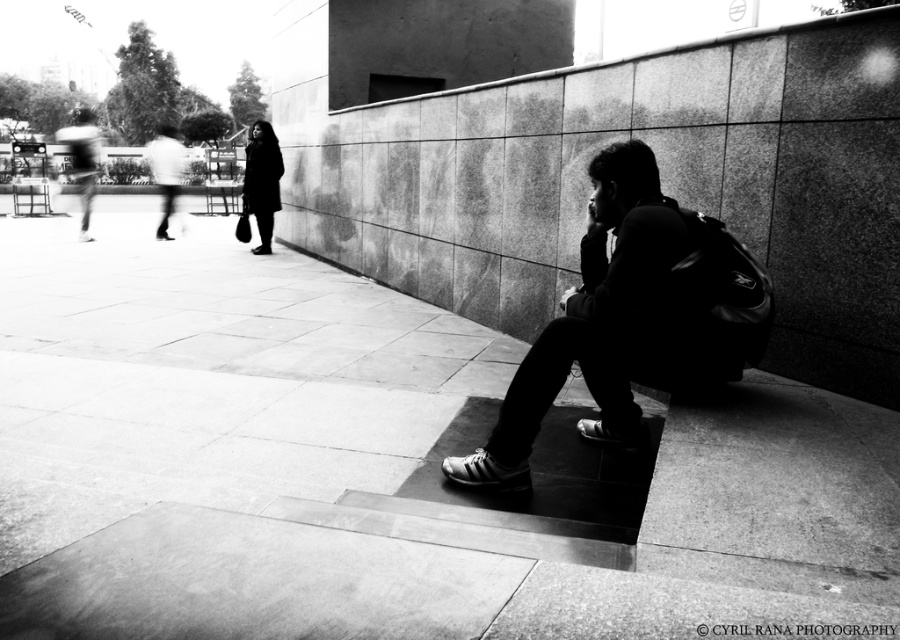
Question: Does smooth concrete pavement at center have a lesser width compared to black leather backpack at center?

Choices:
 (A) yes
 (B) no

Answer: (B)

Question: Is smooth concrete pavement at center closer to the viewer compared to black leather backpack at center?

Choices:
 (A) yes
 (B) no

Answer: (A)

Question: Which point is closer to the camera?

Choices:
 (A) (615, 228)
 (B) (210, 512)

Answer: (B)

Question: Is smooth concrete pavement at center smaller than black leather backpack at center?

Choices:
 (A) yes
 (B) no

Answer: (B)

Question: Which point appears farthest from the camera in this image?

Choices:
 (A) (599, 211)
 (B) (360, 288)

Answer: (B)

Question: Which object appears farthest from the camera in this image?

Choices:
 (A) smooth concrete pavement at center
 (B) black leather backpack at center

Answer: (B)